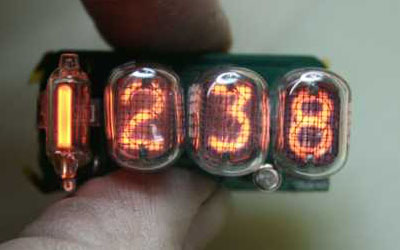
I want to click on bottom right corner empty space, so click(396, 248).